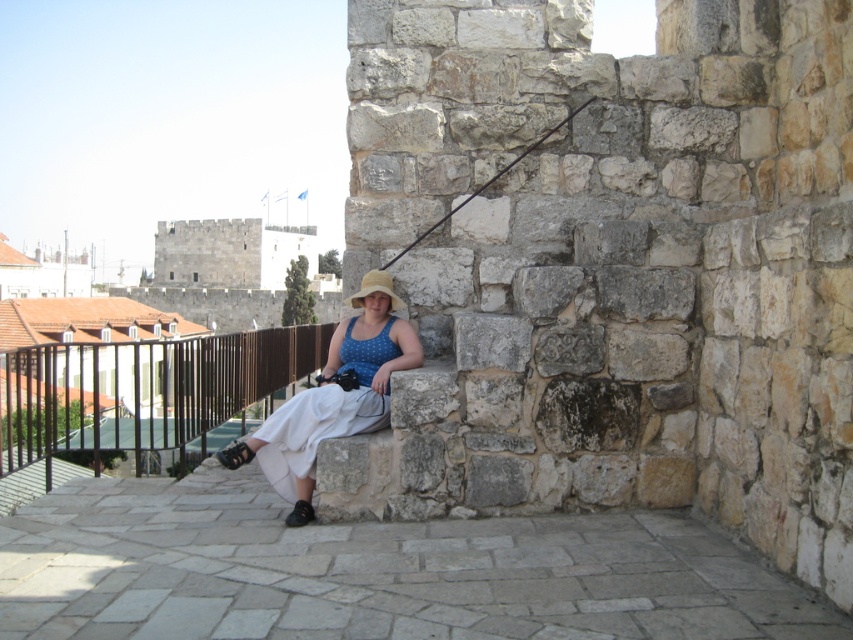
Question: Based on their relative distances, which object is nearer to the rusty metal fishing pole at upper center?

Choices:
 (A) straw hat at center
 (B) matte blue dress at center

Answer: (A)

Question: Is matte blue dress at center positioned before straw hat at center?

Choices:
 (A) no
 (B) yes

Answer: (B)

Question: Which of the following is the farthest from the observer?

Choices:
 (A) (445, 218)
 (B) (369, 282)
 (C) (360, 330)

Answer: (A)

Question: Can you confirm if matte blue dress at center is positioned to the left of straw hat at center?

Choices:
 (A) yes
 (B) no

Answer: (A)

Question: Which point is closer to the camera?

Choices:
 (A) straw hat at center
 (B) matte blue dress at center
 (C) rusty metal fishing pole at upper center

Answer: (B)

Question: Can you confirm if matte blue dress at center is thinner than rusty metal fishing pole at upper center?

Choices:
 (A) yes
 (B) no

Answer: (B)